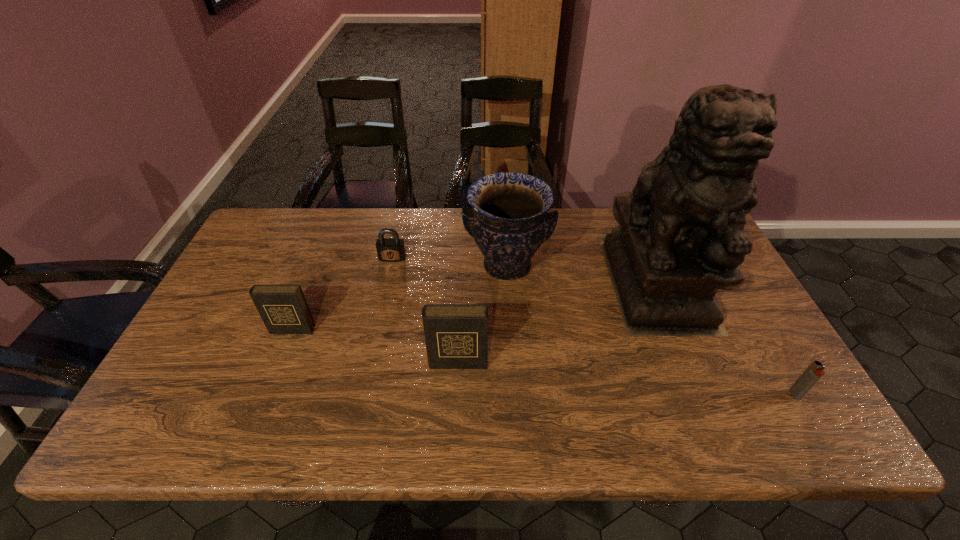
Locate an element on the screen. igniter present at the right edge is located at coordinates (814, 372).

Locate an element on the screen. This screenshot has width=960, height=540. object that is at the far right corner is located at coordinates (680, 237).

Identify the location of object located in the near right corner section of the desktop. This screenshot has width=960, height=540. (814, 372).

In the image, there is a desktop. Identify the location of vacant space at the far edge. (417, 242).

This screenshot has height=540, width=960. What are the coordinates of `vacant position at the near edge of the desktop` in the screenshot? It's located at (409, 370).

What are the coordinates of `vacant space at the left edge of the desktop` in the screenshot? It's located at (236, 279).

In the image, there is a desktop. Where is `blank space at the right edge`? This screenshot has height=540, width=960. blank space at the right edge is located at coordinates pyautogui.click(x=724, y=351).

In the image, there is a desktop. Where is `vacant space at the far left corner`? vacant space at the far left corner is located at coordinates tap(315, 207).

Locate an element on the screen. vacant region between the pottery and the fifth object from right to left is located at coordinates (449, 262).

Locate an element on the screen. This screenshot has width=960, height=540. blank region between the leftmost object and the nearest object is located at coordinates (543, 362).